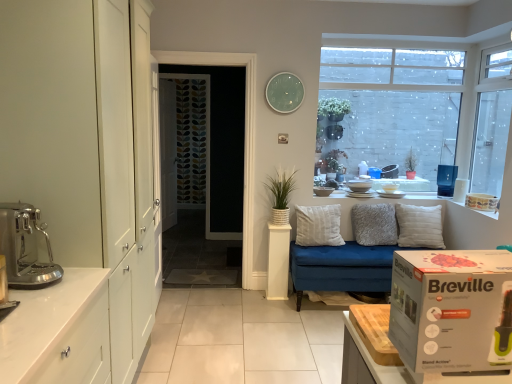
Where is `vacant space behind metallic stainless steel coffee machine at left, the first appliance in the front-to-back sequence`? The height and width of the screenshot is (384, 512). vacant space behind metallic stainless steel coffee machine at left, the first appliance in the front-to-back sequence is located at coordinates (29, 288).